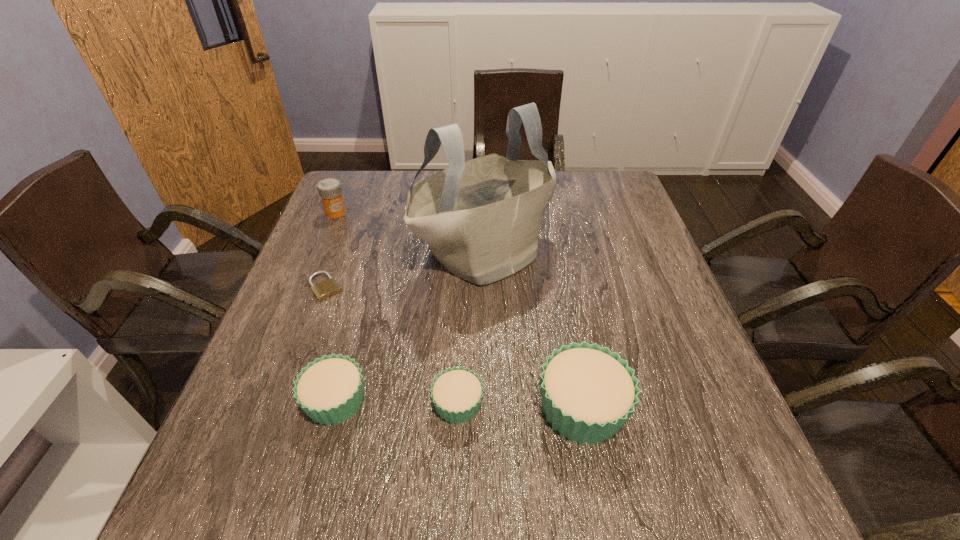
This screenshot has height=540, width=960. What are the coordinates of `vacant space that's between the tallest cupcake and the medicine` in the screenshot? It's located at (459, 310).

Identify the location of free space between the rightmost cupcake and the fifth tallest object. This screenshot has height=540, width=960. (520, 406).

Locate an element on the screen. The image size is (960, 540). free spot between the rightmost cupcake and the farthest object is located at coordinates click(x=459, y=310).

I want to click on vacant region between the fourth tallest object and the tallest object, so click(x=410, y=327).

Image resolution: width=960 pixels, height=540 pixels. In order to click on unoccupied area between the fourth tallest object and the medicine in this screenshot , I will do `click(336, 306)`.

Where is `free spot between the shortest object and the shortest cupcake`? Image resolution: width=960 pixels, height=540 pixels. free spot between the shortest object and the shortest cupcake is located at coordinates (392, 346).

Where is `free space that is in between the tallest object and the second cupcake from left to right`? free space that is in between the tallest object and the second cupcake from left to right is located at coordinates (471, 328).

Locate an element on the screen. the closest object relative to the farthest object is located at coordinates (481, 218).

The height and width of the screenshot is (540, 960). I want to click on the second closest object to the tallest object, so click(x=329, y=189).

The image size is (960, 540). Find the location of `cupcake that can be found as the second closest to the tallest object`. cupcake that can be found as the second closest to the tallest object is located at coordinates pyautogui.click(x=330, y=389).